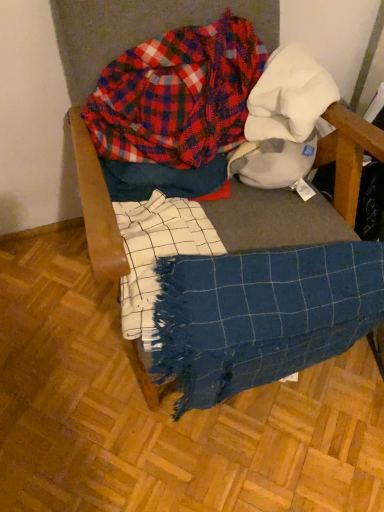
This screenshot has width=384, height=512. I want to click on vacant position to the left of blue woven blanket at center, so click(x=54, y=314).